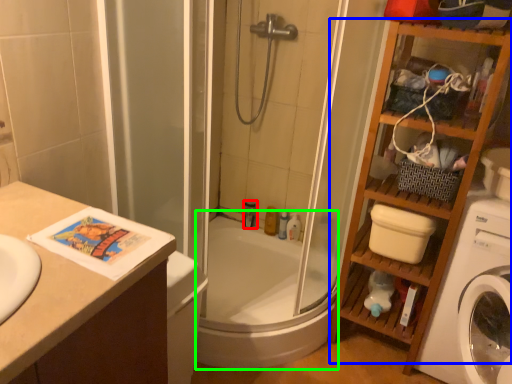
Question: Estimate the real-world distances between objects in this image. Which object is farther from toiletry (highlighted by a red box), cabinet (highlighted by a blue box) or bath (highlighted by a green box)?

Choices:
 (A) cabinet
 (B) bath

Answer: (A)